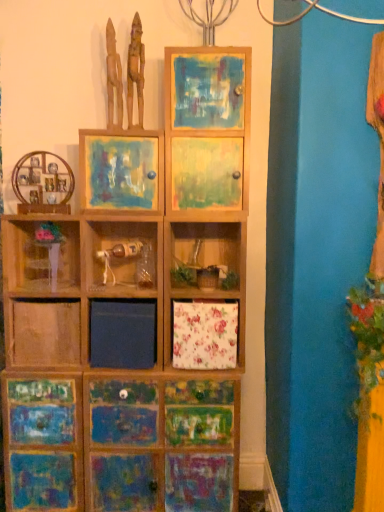
Question: Is wooden painted cabinet at lower left, arranged as the first cabinetry when ordered from the bottom, wider or thinner than painted wood cabinet at upper center?

Choices:
 (A) wide
 (B) thin

Answer: (B)

Question: In terms of height, does wooden painted cabinet at lower left, arranged as the first cabinetry when ordered from the bottom, look taller or shorter compared to painted wood cabinet at upper center?

Choices:
 (A) short
 (B) tall

Answer: (B)

Question: Which of these objects is positioned farthest from the painted wood cabinet at upper center?

Choices:
 (A) wooden painted drawer at center, the second cabinetry from the top
 (B) wooden painted cabinet at lower left, which appears as the 3th cabinetry when viewed from the top
 (C) translucent plastic vase at lower left
 (D) wooden shelf at left, marked as the 3th cabinetry in a bottom-to-top arrangement
 (E) painted wood picture frame at upper center

Answer: (B)

Question: Estimate the real-world distances between objects in this image. Which object is farther from the wooden shelf at left, the 1th cabinetry from the top?

Choices:
 (A) translucent plastic vase at lower left
 (B) painted wood picture frame at upper center
 (C) wooden figure at upper left, positioned as the 2th sculpture in left-to-right order
 (D) wooden painted drawer at center, the 2th cabinetry positioned from the bottom
 (E) wooden painted cabinet at lower left, arranged as the first cabinetry when ordered from the bottom

Answer: (D)